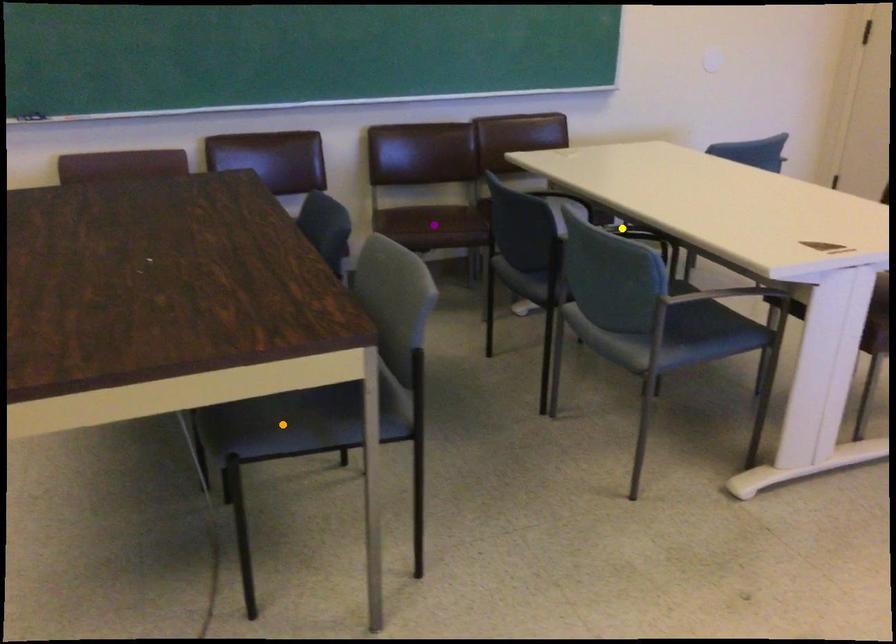
Order these from nearest to farthest:
- orange point
- yellow point
- purple point

orange point, yellow point, purple point